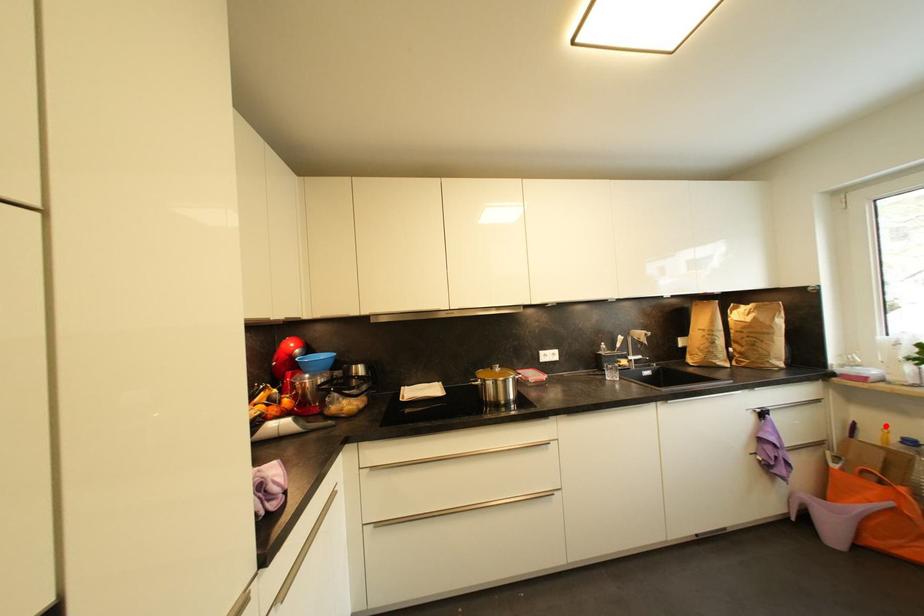
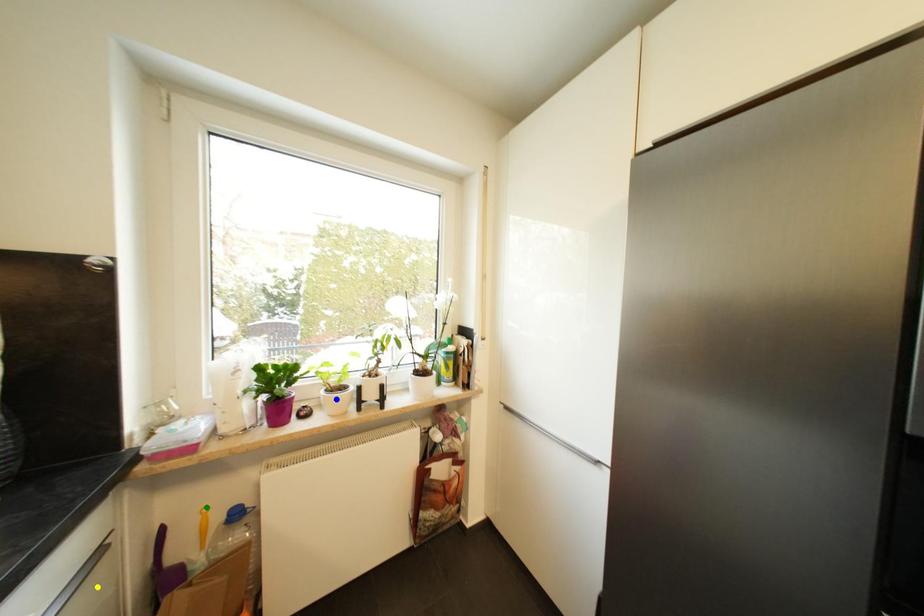
Question: I am providing you with two images of the same scene from different viewpoints. A red point is marked on the first image. You are given multiple points on the second image. In image 2, which mark is for the same physical point as the one in image 1?

Choices:
 (A) green point
 (B) blue point
 (C) yellow point

Answer: (A)